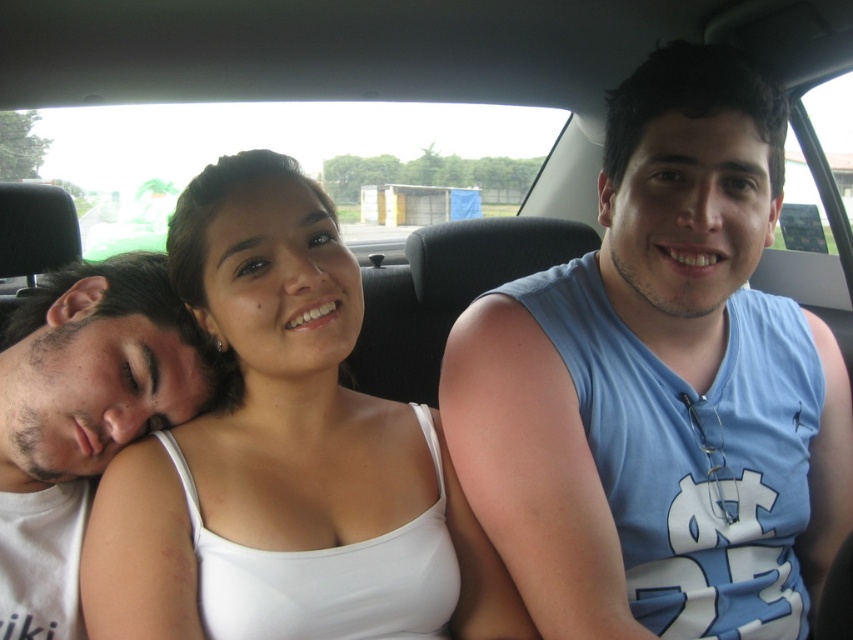
Does blue sleeveless shirt at upper right have a larger size compared to white matte tank top at center?

Yes, blue sleeveless shirt at upper right is bigger than white matte tank top at center.

Does blue sleeveless shirt at upper right appear on the right side of white matte tank top at center?

Indeed, blue sleeveless shirt at upper right is positioned on the right side of white matte tank top at center.

Between point (529, 436) and point (300, 355), which one is positioned in front?

Positioned in front is point (300, 355).

This screenshot has height=640, width=853. Find the location of `blue sleeveless shirt at upper right`. blue sleeveless shirt at upper right is located at coordinates (660, 387).

Is point (483, 307) positioned before point (77, 401)?

No.

Describe the element at coordinates (660, 387) in the screenshot. I see `blue sleeveless shirt at upper right` at that location.

This screenshot has height=640, width=853. I want to click on blue sleeveless shirt at upper right, so click(660, 387).

Is white matte tank top at center further to the viewer compared to white cotton shirt at left?

No, white matte tank top at center is closer to the viewer.

Is point (230, 280) positioned in front of point (64, 296)?

Yes, it is.

Measure the distance between point [299,400] and camera.

The distance of point [299,400] from camera is 1.01 meters.

Where is `white matte tank top at center`? This screenshot has width=853, height=640. white matte tank top at center is located at coordinates (285, 456).